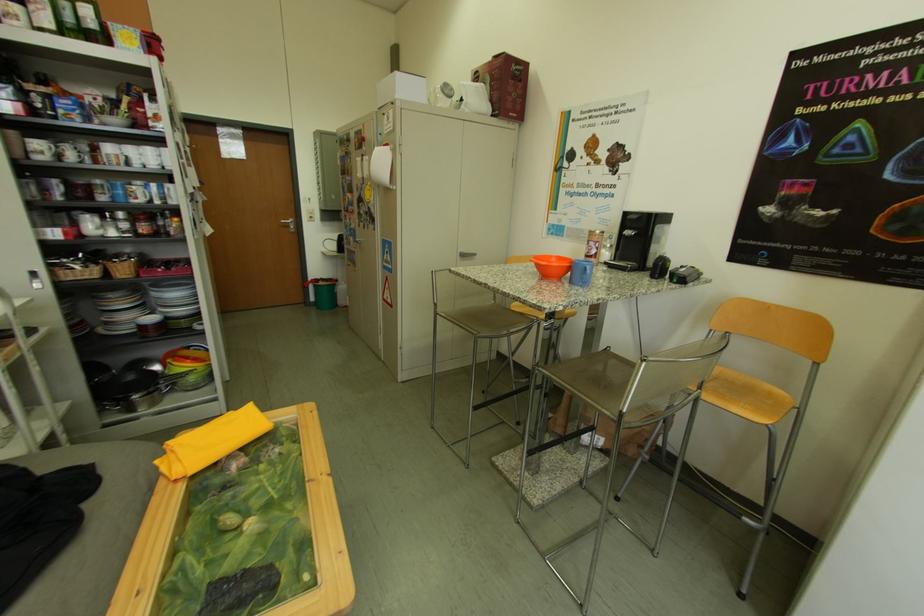
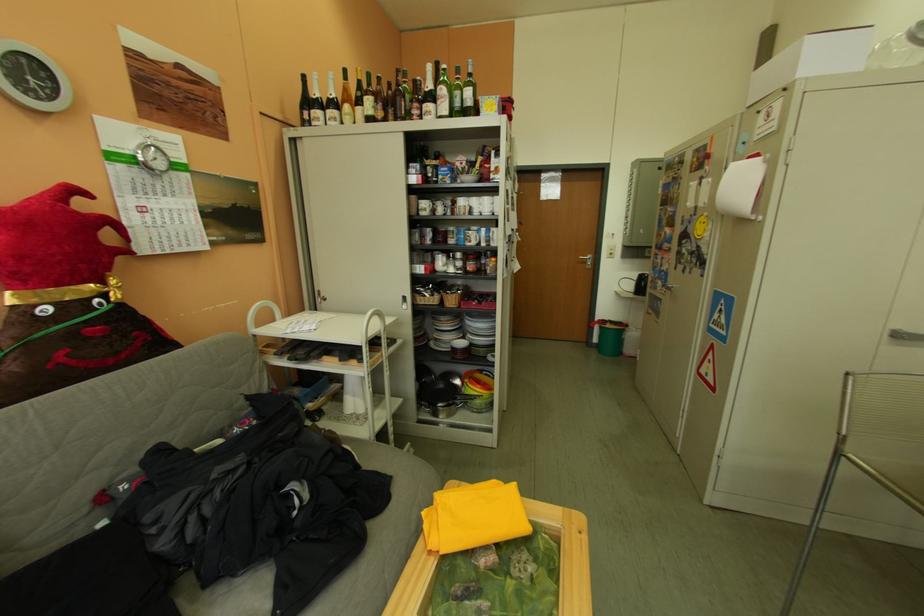
Locate, in the second image, the point that corresponds to [332,285] in the first image.

(617, 326)